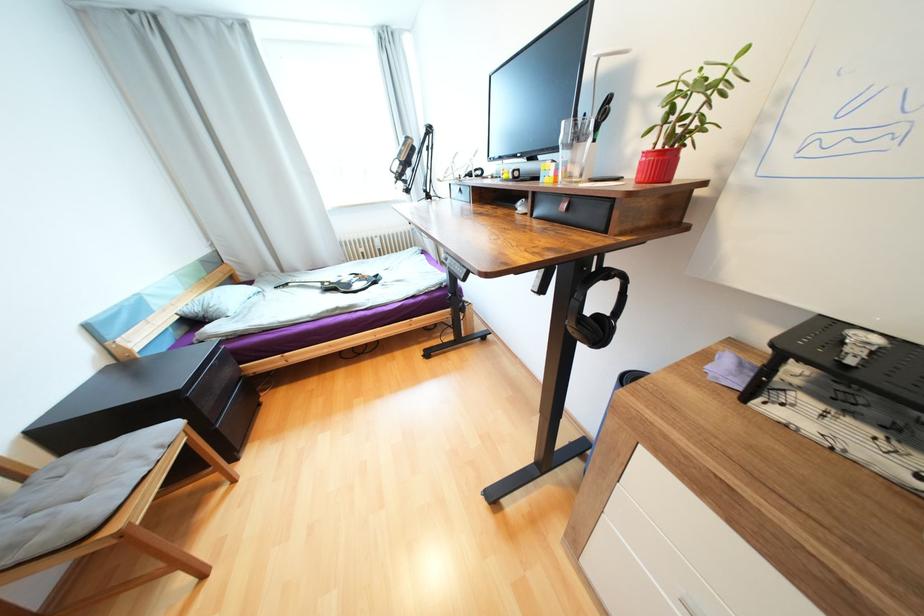
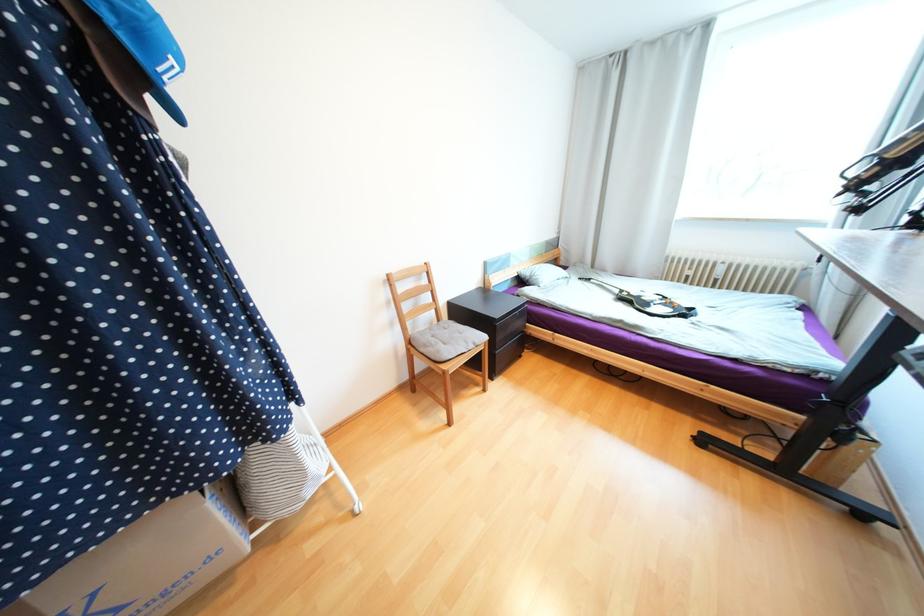
Question: The camera is either moving clockwise (left) or counter-clockwise (right) around the object. The first image is from the beginning of the video and the second image is from the end. Is the camera moving left or right when shooting the video?

Choices:
 (A) Left
 (B) Right

Answer: (B)